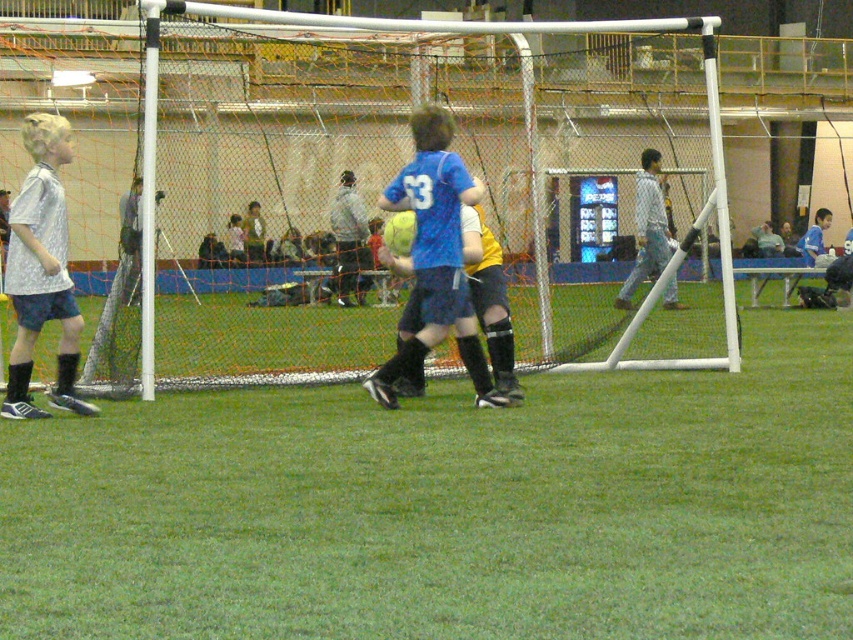
Is green grass at center taller than blue jersey at center?

In fact, green grass at center may be shorter than blue jersey at center.

Does point (708, 566) come behind point (422, 160)?

No, it is in front of (422, 160).

The height and width of the screenshot is (640, 853). Describe the element at coordinates (450, 508) in the screenshot. I see `green grass at center` at that location.

What are the coordinates of `green grass at center` in the screenshot? It's located at (450, 508).

Who is shorter, white mesh net at center or silver metallic shirt at left?

With less height is silver metallic shirt at left.

Does white mesh net at center have a lesser width compared to silver metallic shirt at left?

Incorrect, white mesh net at center's width is not less than silver metallic shirt at left's.

Between point (578, 64) and point (55, 163), which one is positioned behind?

The point (578, 64) is more distant.

Find the location of a particular element. The width and height of the screenshot is (853, 640). white mesh net at center is located at coordinates (375, 179).

Which of these two, green grass at center or white shirt at center, stands shorter?

Standing shorter between the two is green grass at center.

Is green grass at center below white shirt at center?

Yes.

Image resolution: width=853 pixels, height=640 pixels. What are the coordinates of `green grass at center` in the screenshot? It's located at (450, 508).

At what (x,y) coordinates should I click in order to perform the action: click on green grass at center. Please return your answer as a coordinate pair (x, y). This screenshot has width=853, height=640. Looking at the image, I should click on (450, 508).